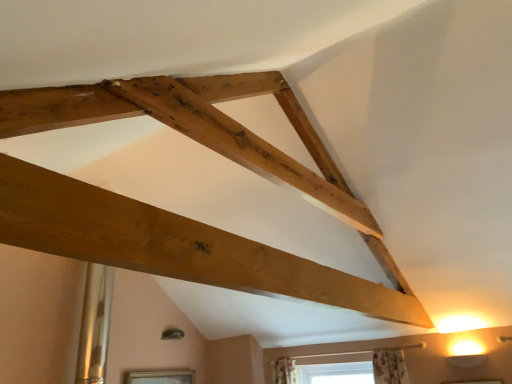
What do you see at coordinates (176, 214) in the screenshot? This screenshot has width=512, height=384. I see `natural wood beam at upper center` at bounding box center [176, 214].

Where is `natural wood beam at upper center`? This screenshot has width=512, height=384. natural wood beam at upper center is located at coordinates pyautogui.click(x=176, y=214).

Measure the distance between natural wood beam at upper center and camera.

They are 3.52 feet apart.

At what (x,y) coordinates should I click in order to perform the action: click on natural wood beam at upper center. Please return your answer as a coordinate pair (x, y). Looking at the image, I should click on (176, 214).